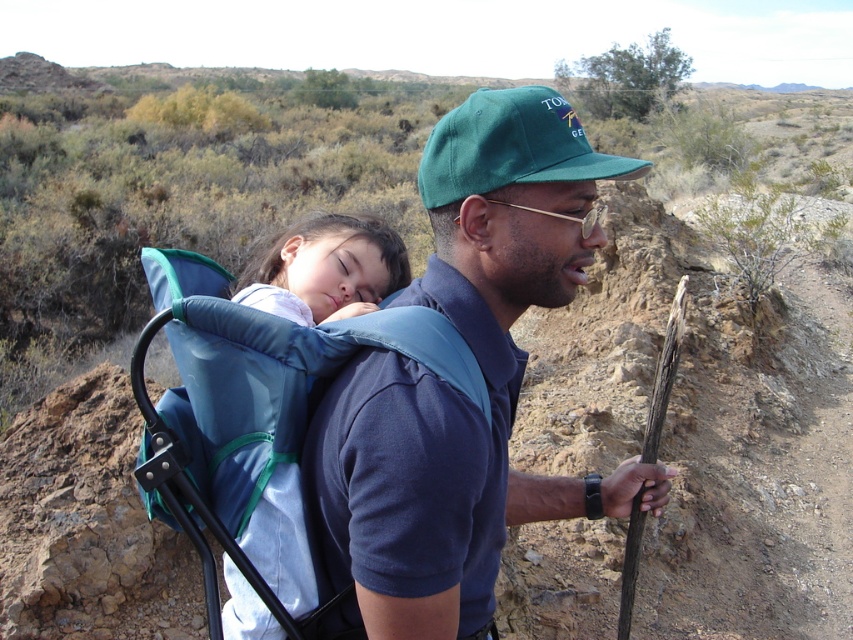
Question: Which object is closer to the camera taking this photo?

Choices:
 (A) green fabric baseball cap at center
 (B) blue fabric backpack at upper left

Answer: (B)

Question: Can you confirm if blue fabric backpack at upper left is positioned to the left of green fabric baseball cap at center?

Choices:
 (A) no
 (B) yes

Answer: (B)

Question: Can you confirm if blue fabric backpack at upper left is positioned to the left of green fabric baseball cap at center?

Choices:
 (A) no
 (B) yes

Answer: (B)

Question: Which point appears closest to the camera in this image?

Choices:
 (A) (448, 451)
 (B) (469, 112)

Answer: (A)

Question: Observing the image, what is the correct spatial positioning of blue fabric backpack at upper left in reference to green fabric baseball cap at center?

Choices:
 (A) left
 (B) right

Answer: (A)